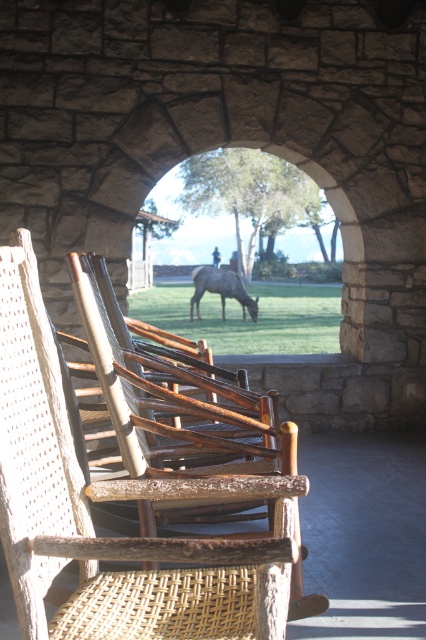
You are standing at the stone archway and want to walk towards the deer. There are two points marked on the path. Which point should you walk towards first, point (135, 435) or point (221, 282)?

You should walk towards point (135, 435) first because it is in front of point (221, 282) along your path to the deer.

You are planning to place a new bench in the garden that needs to be shorter than the existing woven wood beach chair at center. There is a brown textured horse at center nearby. Which object should you compare the bench height to ensure it meets the requirement?

The woven wood beach chair at center is much taller than the brown textured horse at center. To ensure the bench is shorter than the existing chair, you should compare its height to the woven wood beach chair at center since it is the taller object.